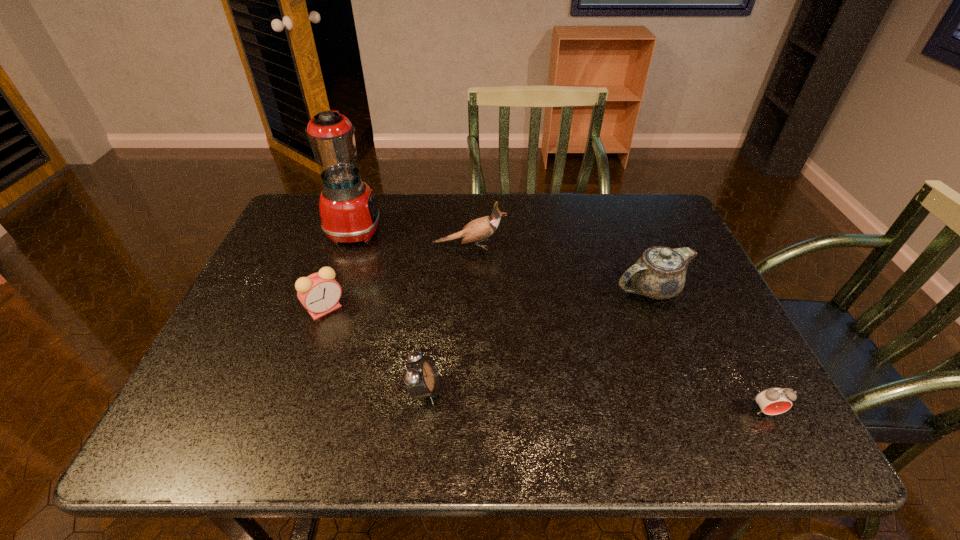
This screenshot has width=960, height=540. Find the location of `blank space located from the spout of the chinaware`. blank space located from the spout of the chinaware is located at coordinates (593, 289).

Identify the location of vacant area located from the spout of the chinaware. (498, 289).

Find the location of a particular element. The height and width of the screenshot is (540, 960). vacant space situated 0.100m on the face of the farthest alarm clock is located at coordinates (308, 357).

At what (x,y) coordinates should I click in order to perform the action: click on vacant space located 0.050m on the face of the second alarm clock from left to right. Please return your answer as a coordinate pair (x, y). The image size is (960, 540). Looking at the image, I should click on (465, 390).

Locate an element on the screen. This screenshot has width=960, height=540. food processor that is positioned at the far edge is located at coordinates (349, 214).

Where is `bird that is at the far edge`? The width and height of the screenshot is (960, 540). bird that is at the far edge is located at coordinates (481, 228).

Locate an element on the screen. object that is at the near edge is located at coordinates (772, 401).

You are a GUI agent. You are given a task and a screenshot of the screen. Output one action in this format:
    pyautogui.click(x=<x>, y=<y>)
    Task: Click on the object positioned at the left edge
    The image size is (960, 540).
    Given the screenshot: What is the action you would take?
    pyautogui.click(x=349, y=214)

I want to click on chinaware situated at the right edge, so click(659, 273).

The height and width of the screenshot is (540, 960). Identify the location of alarm clock at the right edge. (772, 401).